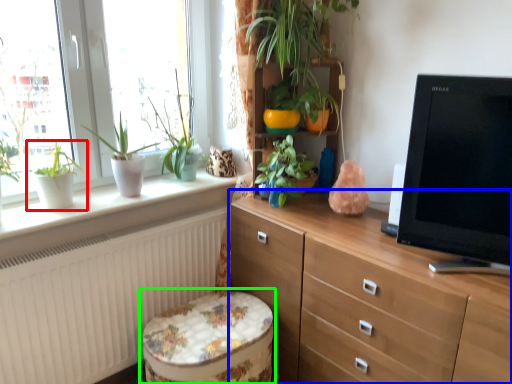
Question: Which is nearer to the houseplant (highlighted by a red box)? chest of drawers (highlighted by a blue box) or music stool (highlighted by a green box).

Choices:
 (A) chest of drawers
 (B) music stool

Answer: (B)